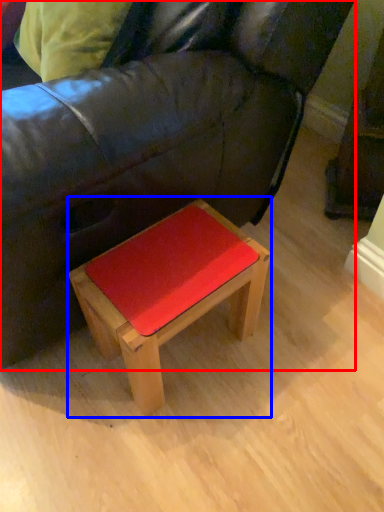
Question: Which of the following is the closest to the observer, studio couch (highlighted by a red box) or table (highlighted by a blue box)?

Choices:
 (A) studio couch
 (B) table

Answer: (A)